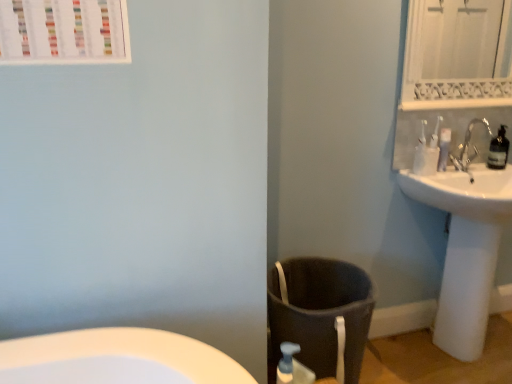
The height and width of the screenshot is (384, 512). I want to click on white plastic toilet paper at upper right, so click(425, 160).

Locate an element on the screen. The width and height of the screenshot is (512, 384). white glossy sink at right is located at coordinates (465, 248).

The image size is (512, 384). What do you see at coordinates (498, 150) in the screenshot?
I see `transparent plastic bottle at upper right` at bounding box center [498, 150].

At what (x,y) coordinates should I click in order to perform the action: click on white ceramic faucet at upper right. Please return your answer as a coordinate pair (x, y). Looking at the image, I should click on (468, 146).

Locate an element on the screen. The height and width of the screenshot is (384, 512). white textured mirror at upper right is located at coordinates (456, 54).

Is white plastic toilet paper at upper right not inside white glossy sink at right?

Indeed, white plastic toilet paper at upper right is completely outside white glossy sink at right.

At what (x,y) coordinates should I click in order to perform the action: click on toilet paper behind the white glossy sink at right. Please return your answer as a coordinate pair (x, y). The height and width of the screenshot is (384, 512). Looking at the image, I should click on (425, 160).

Is white plastic toilet paper at upper right positioned in front of white glossy sink at right?

That is False.

Considering the sizes of white plastic toilet paper at upper right and white glossy sink at right in the image, is white plastic toilet paper at upper right bigger or smaller than white glossy sink at right?

Clearly, white plastic toilet paper at upper right is smaller in size than white glossy sink at right.

From a real-world perspective, is white plastic toothbrushes at upper right above or below white textured mirror at upper right?

From a real-world perspective, white plastic toothbrushes at upper right is physically below white textured mirror at upper right.

Are white plastic toothbrushes at upper right and white textured mirror at upper right located far from each other?

Indeed, white plastic toothbrushes at upper right is not near white textured mirror at upper right.

Does white plastic toothbrushes at upper right have a greater width compared to white textured mirror at upper right?

Indeed, white plastic toothbrushes at upper right has a greater width compared to white textured mirror at upper right.

Is white plastic toothbrushes at upper right not inside white textured mirror at upper right?

white plastic toothbrushes at upper right lies outside white textured mirror at upper right's area.

Where is `soap dispenser in front of the white ceramic faucet at upper right`? This screenshot has width=512, height=384. soap dispenser in front of the white ceramic faucet at upper right is located at coordinates (292, 367).

In the image, is white ceramic faucet at upper right on the left side or the right side of translucent plastic soap dispenser at lower center?

Clearly, white ceramic faucet at upper right is on the right of translucent plastic soap dispenser at lower center in the image.

What's the angular difference between white ceramic faucet at upper right and translucent plastic soap dispenser at lower center's facing directions?

84.9 degrees.

Is white ceramic faucet at upper right bigger than translucent plastic soap dispenser at lower center?

Yes.

Would you say dark gray fabric laundry basket at lower center is inside or outside white plastic toothbrushes at upper right?

dark gray fabric laundry basket at lower center is located beyond the bounds of white plastic toothbrushes at upper right.

Does dark gray fabric laundry basket at lower center have a smaller size compared to white plastic toothbrushes at upper right?

No, dark gray fabric laundry basket at lower center is not smaller than white plastic toothbrushes at upper right.

Considering the relative sizes of dark gray fabric laundry basket at lower center and white plastic toothbrushes at upper right in the image provided, is dark gray fabric laundry basket at lower center thinner than white plastic toothbrushes at upper right?

No, dark gray fabric laundry basket at lower center is not thinner than white plastic toothbrushes at upper right.

Does point (306, 259) appear closer or farther from the camera than point (442, 159)?

Clearly, point (306, 259) is closer to the camera than point (442, 159).

Which is nearer, (453, 159) or (336, 292)?

The point (336, 292) is more forward.

Which of these two, white ceramic faucet at upper right or dark gray fabric laundry basket at lower center, is smaller?

white ceramic faucet at upper right is smaller.

Could you tell me if white ceramic faucet at upper right is turned towards dark gray fabric laundry basket at lower center?

No, white ceramic faucet at upper right does not turn towards dark gray fabric laundry basket at lower center.

Can you tell me how much white glossy sink at right and white ceramic faucet at upper right differ in facing direction?

The facing directions of white glossy sink at right and white ceramic faucet at upper right are 1.58 degrees apart.

Does white glossy sink at right touch white ceramic faucet at upper right?

No, white glossy sink at right is not in contact with white ceramic faucet at upper right.

Consider the image. From a real-world perspective, which is physically above, white glossy sink at right or white ceramic faucet at upper right?

From a 3D spatial view, white ceramic faucet at upper right is above.

The image size is (512, 384). I want to click on laundry basket below the translucent plastic soap dispenser at lower center (from the image's perspective), so click(321, 314).

Based on their positions, is dark gray fabric laundry basket at lower center located to the left or right of translucent plastic soap dispenser at lower center?

From the image, it's evident that dark gray fabric laundry basket at lower center is to the right of translucent plastic soap dispenser at lower center.

Consider the image. Between dark gray fabric laundry basket at lower center and translucent plastic soap dispenser at lower center, which one has less height?

Standing shorter between the two is translucent plastic soap dispenser at lower center.

Measure the distance between dark gray fabric laundry basket at lower center and translucent plastic soap dispenser at lower center.

A distance of 24.00 centimeters exists between dark gray fabric laundry basket at lower center and translucent plastic soap dispenser at lower center.

Identify the location of toilet paper above the white glossy sink at right (from a real-world perspective). (425, 160).

Find the location of `toiletry below the white textured mirror at upper right (from the image's perspective)`. toiletry below the white textured mirror at upper right (from the image's perspective) is located at coordinates (444, 149).

When comparing their distances from transparent plastic bottle at upper right, does dark gray fabric laundry basket at lower center or white plastic toilet paper at upper right seem closer?

white plastic toilet paper at upper right.

Looking at the image, which one is located closer to translucent plastic soap dispenser at lower center, white plastic toothbrushes at upper right or white plastic toilet paper at upper right?

white plastic toilet paper at upper right is closer to translucent plastic soap dispenser at lower center.

Considering their positions, is white glossy sink at right positioned closer to white textured mirror at upper right than white ceramic faucet at upper right?

white ceramic faucet at upper right is closer to white textured mirror at upper right.

From the image, which object appears to be farther from translucent plastic soap dispenser at lower center, white plastic toilet paper at upper right or dark gray fabric laundry basket at lower center?

white plastic toilet paper at upper right is positioned further to the anchor translucent plastic soap dispenser at lower center.

Considering their positions, is transparent plastic bottle at upper right positioned further to dark gray fabric laundry basket at lower center than white textured mirror at upper right?

Among the two, white textured mirror at upper right is located further to dark gray fabric laundry basket at lower center.

Based on their spatial positions, is white plastic toilet paper at upper right or white plastic toothbrushes at upper right further from dark gray fabric laundry basket at lower center?

Based on the image, white plastic toothbrushes at upper right appears to be further to dark gray fabric laundry basket at lower center.

Which object lies nearer to the anchor point white plastic toothbrushes at upper right, dark gray fabric laundry basket at lower center or white ceramic faucet at upper right?

white ceramic faucet at upper right lies closer to white plastic toothbrushes at upper right than the other object.

Considering their positions, is translucent plastic soap dispenser at lower center positioned further to white ceramic faucet at upper right than dark gray fabric laundry basket at lower center?

translucent plastic soap dispenser at lower center is positioned further to the anchor white ceramic faucet at upper right.

Find the location of a particular element. The height and width of the screenshot is (384, 512). toiletry that lies between white textured mirror at upper right and translucent plastic soap dispenser at lower center from top to bottom is located at coordinates (444, 149).

The width and height of the screenshot is (512, 384). I want to click on tap between transparent plastic bottle at upper right and white glossy sink at right vertically, so click(x=468, y=146).

At what (x,y) coordinates should I click in order to perform the action: click on bottle between white textured mirror at upper right and white plastic toothbrushes at upper right in the vertical direction. Please return your answer as a coordinate pair (x, y). Looking at the image, I should click on (498, 150).

The height and width of the screenshot is (384, 512). I want to click on tap located between translucent plastic soap dispenser at lower center and transparent plastic bottle at upper right in the left-right direction, so click(468, 146).